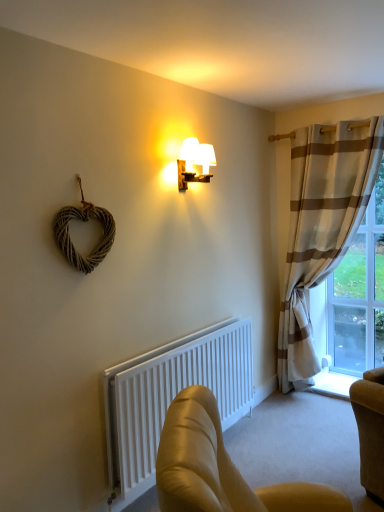
Describe the element at coordinates (171, 397) in the screenshot. I see `white matte radiator at lower center` at that location.

Find the location of `woodenmaterial/texturelamp at upper center`. woodenmaterial/texturelamp at upper center is located at coordinates (194, 162).

You are a GUI agent. You are given a task and a screenshot of the screen. Output one action in this format:
    pyautogui.click(x=<x>, y=<y>)
    Task: Click on the clear glass window at right
    
    Given the screenshot: What is the action you would take?
    pyautogui.click(x=360, y=294)

What do you see at coordinates (220, 468) in the screenshot? I see `leather armchair at lower center` at bounding box center [220, 468].

Find the location of `white striped fabric curtain at right`. white striped fabric curtain at right is located at coordinates (322, 225).

I want to click on curtain above the white matte radiator at lower center (from the image's perspective), so click(322, 225).

In the scene shown: Who is taller, white striped fabric curtain at right or white matte radiator at lower center?

Standing taller between the two is white striped fabric curtain at right.

Does white striped fabric curtain at right have a larger size compared to white matte radiator at lower center?

Correct, white striped fabric curtain at right is larger in size than white matte radiator at lower center.

Is white striped fabric curtain at right situated inside white matte radiator at lower center or outside?

white striped fabric curtain at right is outside white matte radiator at lower center.

In the image, is woodenmaterial/texturelamp at upper center positioned in front of or behind leather armchair at lower center?

Clearly, woodenmaterial/texturelamp at upper center is behind leather armchair at lower center.

In the image, there is a leather armchair at lower center. Identify the location of lamp above it (from the image's perspective). This screenshot has height=512, width=384. pos(194,162).

From the image's perspective, is woodenmaterial/texturelamp at upper center above or below leather armchair at lower center?

Clearly, from the image's perspective, woodenmaterial/texturelamp at upper center is above leather armchair at lower center.

Between point (159, 390) and point (330, 162), which one is positioned in front?

Point (159, 390)

From the picture: Could you tell me if white matte radiator at lower center is turned towards white striped fabric curtain at right?

No, white matte radiator at lower center is not oriented towards white striped fabric curtain at right.

Considering the relative sizes of white matte radiator at lower center and white striped fabric curtain at right in the image provided, is white matte radiator at lower center wider than white striped fabric curtain at right?

No, white matte radiator at lower center is not wider than white striped fabric curtain at right.

Can you confirm if leather armchair at lower center is thinner than white striped fabric curtain at right?

No, leather armchair at lower center is not thinner than white striped fabric curtain at right.

From the picture: Is leather armchair at lower center looking in the opposite direction of white striped fabric curtain at right?

leather armchair at lower center is not turned away from white striped fabric curtain at right.

From the image's perspective, is leather armchair at lower center under white striped fabric curtain at right?

Yes, from the image's perspective, leather armchair at lower center is below white striped fabric curtain at right.

Between leather armchair at lower center and white striped fabric curtain at right, which one has less height?

Standing shorter between the two is leather armchair at lower center.

Can you confirm if white matte radiator at lower center is taller than leather armchair at lower center?

Correct, white matte radiator at lower center is much taller as leather armchair at lower center.

Is white matte radiator at lower center facing towards leather armchair at lower center?

Yes, white matte radiator at lower center is facing leather armchair at lower center.

Is white matte radiator at lower center placed right next to leather armchair at lower center?

white matte radiator at lower center is not next to leather armchair at lower center, and they're not touching.

Is white matte radiator at lower center in front of leather armchair at lower center?

No.

Based on the photo, can you confirm if white striped fabric curtain at right is shorter than woodenmaterial/texturelamp at upper center?

No.

From the image's perspective, is white striped fabric curtain at right positioned above or below woodenmaterial/texturelamp at upper center?

Clearly, from the image's perspective, white striped fabric curtain at right is below woodenmaterial/texturelamp at upper center.

Is white striped fabric curtain at right aimed at woodenmaterial/texturelamp at upper center?

Yes, white striped fabric curtain at right is aimed at woodenmaterial/texturelamp at upper center.

What's the angular difference between woodenmaterial/texturelamp at upper center and white matte radiator at lower center's facing directions?

There is a 1.1-degree angle between the facing directions of woodenmaterial/texturelamp at upper center and white matte radiator at lower center.

Considering the positions of objects woodenmaterial/texturelamp at upper center and white matte radiator at lower center in the image provided, who is more to the right, woodenmaterial/texturelamp at upper center or white matte radiator at lower center?

white matte radiator at lower center.

Which is nearer, (x=209, y=147) or (x=201, y=369)?

The point (x=209, y=147) is in front.

The image size is (384, 512). Identify the location of lamp located on the left of white matte radiator at lower center. (194, 162).

The image size is (384, 512). I want to click on radiator below the white striped fabric curtain at right (from the image's perspective), so click(171, 397).

You are a GUI agent. You are given a task and a screenshot of the screen. Output one action in this format:
    pyautogui.click(x=<x>, y=<y>)
    Task: Click on the chair below the woodenmaterial/texturelamp at upper center (from a real-world perspective)
    
    Given the screenshot: What is the action you would take?
    pyautogui.click(x=220, y=468)

Estimate the real-world distances between objects in this image. Which object is closer to clear glass window at right, white striped fabric curtain at right or leather armchair at lower center?

white striped fabric curtain at right.

Based on their spatial positions, is white striped fabric curtain at right or clear glass window at right closer to woodenmaterial/texturelamp at upper center?

white striped fabric curtain at right is closer to woodenmaterial/texturelamp at upper center.

Which object lies nearer to the anchor point woodenmaterial/texturelamp at upper center, white matte radiator at lower center or white striped fabric curtain at right?

white matte radiator at lower center is closer to woodenmaterial/texturelamp at upper center.

Estimate the real-world distances between objects in this image. Which object is further from woodenmaterial/texturelamp at upper center, leather armchair at lower center or white matte radiator at lower center?

leather armchair at lower center is further to woodenmaterial/texturelamp at upper center.

From the image, which object appears to be nearer to white matte radiator at lower center, clear glass window at right or woodenmaterial/texturelamp at upper center?

woodenmaterial/texturelamp at upper center is closer to white matte radiator at lower center.

Based on their spatial positions, is woodenmaterial/texturelamp at upper center or white matte radiator at lower center further from white striped fabric curtain at right?

The object further to white striped fabric curtain at right is woodenmaterial/texturelamp at upper center.

Based on their spatial positions, is white matte radiator at lower center or clear glass window at right further from white striped fabric curtain at right?

white matte radiator at lower center is further to white striped fabric curtain at right.

Which object lies nearer to the anchor point white matte radiator at lower center, woodenmaterial/texturelamp at upper center or white striped fabric curtain at right?

white striped fabric curtain at right is closer to white matte radiator at lower center.

This screenshot has height=512, width=384. I want to click on radiator that lies between woodenmaterial/texturelamp at upper center and leather armchair at lower center from top to bottom, so [x=171, y=397].

At what (x,y) coordinates should I click in order to perform the action: click on curtain positioned between leather armchair at lower center and clear glass window at right from near to far. Please return your answer as a coordinate pair (x, y). Looking at the image, I should click on (322, 225).

Identify the location of lamp positioned between leather armchair at lower center and clear glass window at right from near to far. (194, 162).

Identify the location of curtain between woodenmaterial/texturelamp at upper center and white matte radiator at lower center in the vertical direction. (322, 225).